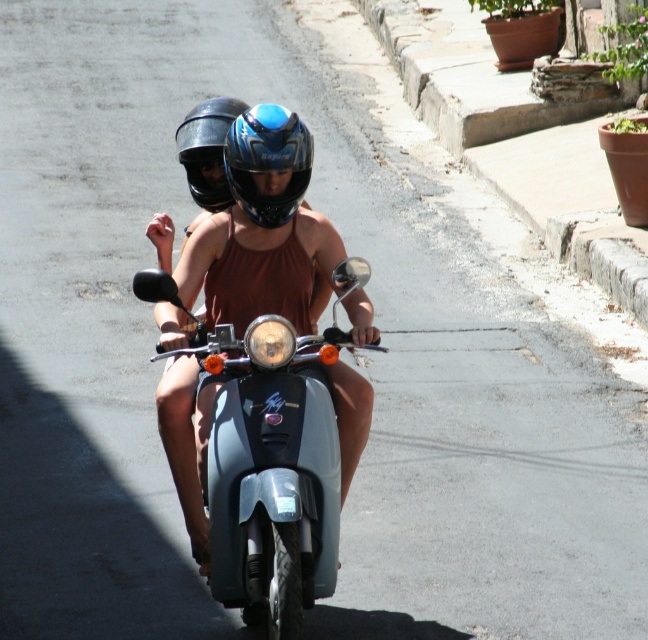
Consider the image. Does metallic blue scooter at center have a greater width compared to shiny black helmet at center?

Indeed, metallic blue scooter at center has a greater width compared to shiny black helmet at center.

Based on the photo, who is more distant from viewer, (243, 593) or (213, 198)?

Positioned behind is point (213, 198).

Is point (264, 602) in front of point (202, 172)?

That is True.

Find the location of a particular element. metallic blue scooter at center is located at coordinates (273, 461).

Which is below, blue glossy helmet at center or shiny black helmet at center?

blue glossy helmet at center is lower down.

Can you confirm if blue glossy helmet at center is positioned to the right of shiny black helmet at center?

Yes, blue glossy helmet at center is to the right of shiny black helmet at center.

Who is more forward, (238, 168) or (222, 205)?

Point (238, 168)

This screenshot has width=648, height=640. I want to click on blue glossy helmet at center, so click(268, 161).

Does metallic blue scooter at center have a lesser height compared to blue glossy helmet at center?

No.

Who is more distant from viewer, (x=257, y=568) or (x=264, y=220)?

Point (x=264, y=220)

What are the coordinates of `metallic blue scooter at center` in the screenshot? It's located at (273, 461).